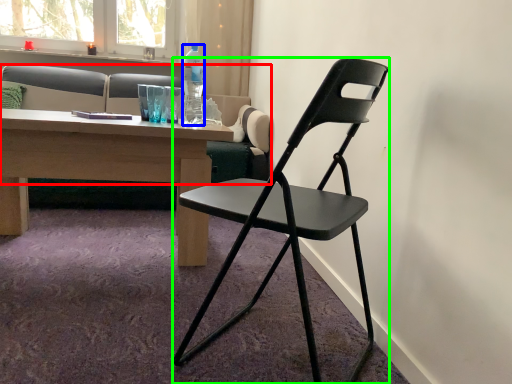
Question: Which object is positioned farthest from studio couch (highlighted by a red box)? Select from bottle (highlighted by a blue box) and chair (highlighted by a green box).

Choices:
 (A) bottle
 (B) chair

Answer: (B)